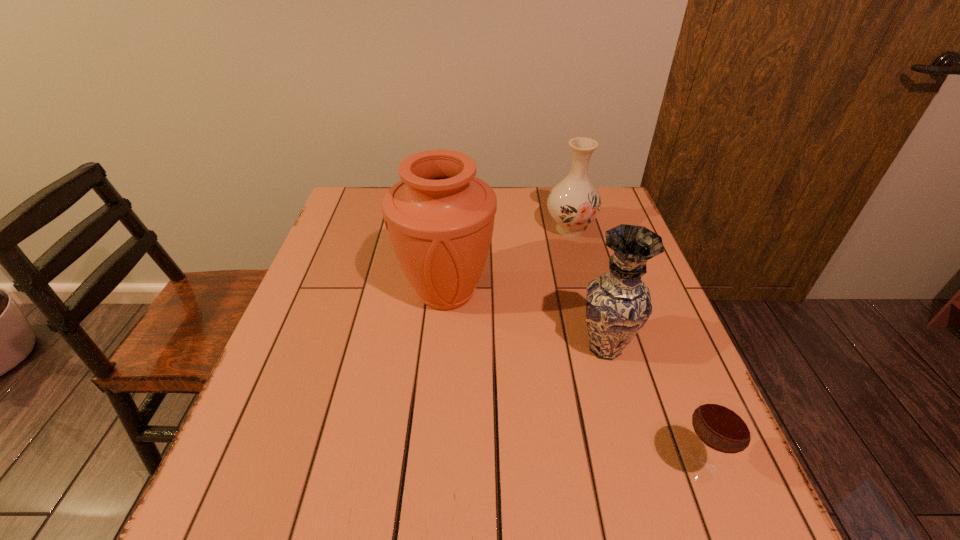
In the image, there is a desktop. At what (x,y) coordinates should I click in order to perform the action: click on free space at the left edge. Please return your answer as a coordinate pair (x, y). This screenshot has height=540, width=960. Looking at the image, I should click on (352, 253).

Find the location of `blank space at the right edge of the desktop`. blank space at the right edge of the desktop is located at coordinates (654, 301).

I want to click on vacant space at the far left corner, so click(359, 193).

Identify the location of vacant region at the far right corner of the desktop. (609, 197).

At what (x,y) coordinates should I click in order to perform the action: click on vacant region between the farthest vase and the leftmost object. Please return your answer as a coordinate pair (x, y). The height and width of the screenshot is (540, 960). Looking at the image, I should click on (508, 261).

At what (x,y) coordinates should I click in order to perform the action: click on vacant area that lies between the shortest object and the leftmost vase. Please return your answer as a coordinate pair (x, y). The height and width of the screenshot is (540, 960). Looking at the image, I should click on (571, 379).

Locate an element on the screen. This screenshot has height=540, width=960. free space between the farthest object and the leftmost object is located at coordinates (508, 261).

Find the location of a particular element. object that can be found as the second closest to the nearest object is located at coordinates (440, 217).

This screenshot has height=540, width=960. I want to click on the third closest object to the farthest vase, so click(723, 423).

Locate which vase ranks in proximity to the farthest vase. Please provide its 2D coordinates. Your answer should be formatted as a tuple, i.e. [(x, y)], where the tuple contains the x and y coordinates of a point satisfying the conditions above.

[(440, 217)]